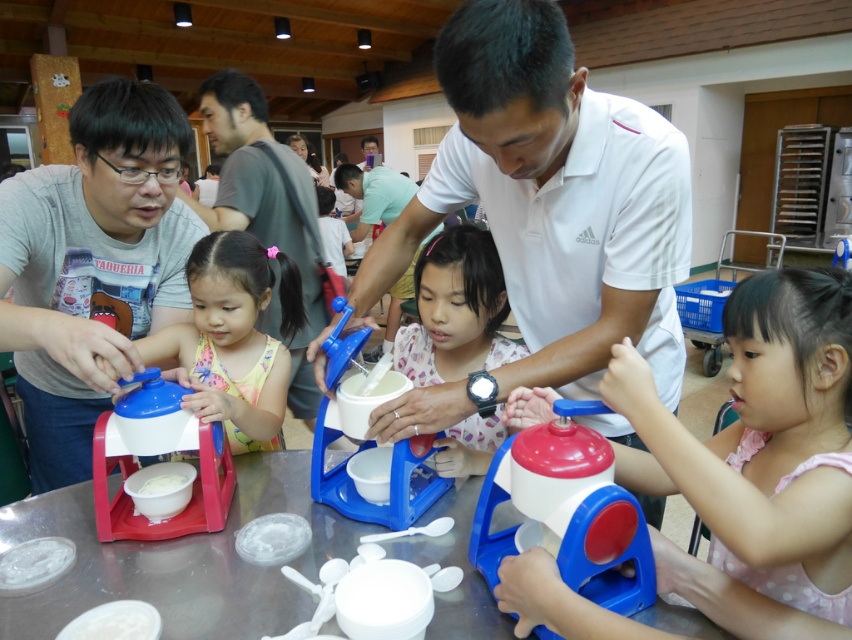
You are a photographer at the event and want to capture a photo of the white matte shirt at center and the matte plastic toy at left. Which object should you focus on first if you want to ensure both are in focus without adjusting the camera settings?

The white matte shirt at center is much taller than the matte plastic toy at left, so focusing on the white matte shirt at center first would ensure both are in focus since it is larger and closer to the camera.

You are standing in the community hall and want to reach both the point at coordinates (522, 232) and the point at (87, 170). Which point will you reach first if you move straight towards them?

You will reach the point at coordinates (522, 232) first because it is closer to you than the point at (87, 170).